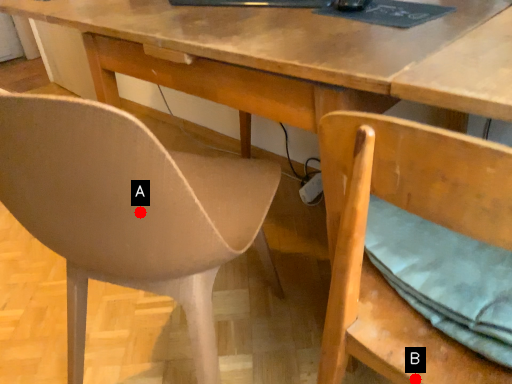
Question: Two points are circled on the image, labeled by A and B beside each circle. Which of the following is the farthest from the observer?

Choices:
 (A) A is further
 (B) B is further

Answer: (A)